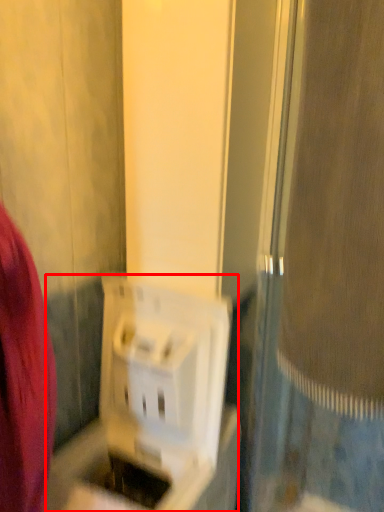
Question: Considering the relative positions of appliance (annotated by the red box) and screen door in the image provided, where is appliance (annotated by the red box) located with respect to the staircase?

Choices:
 (A) right
 (B) left

Answer: (B)